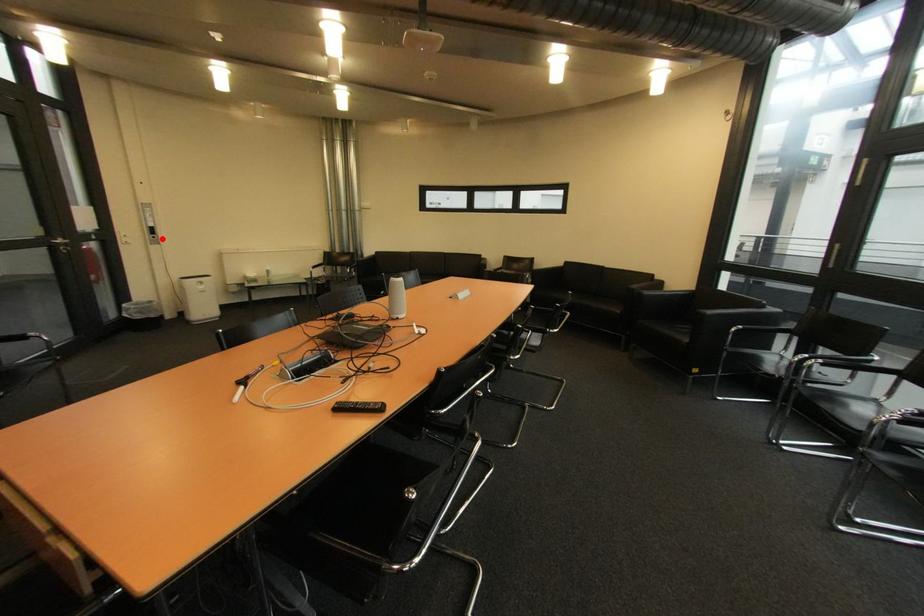
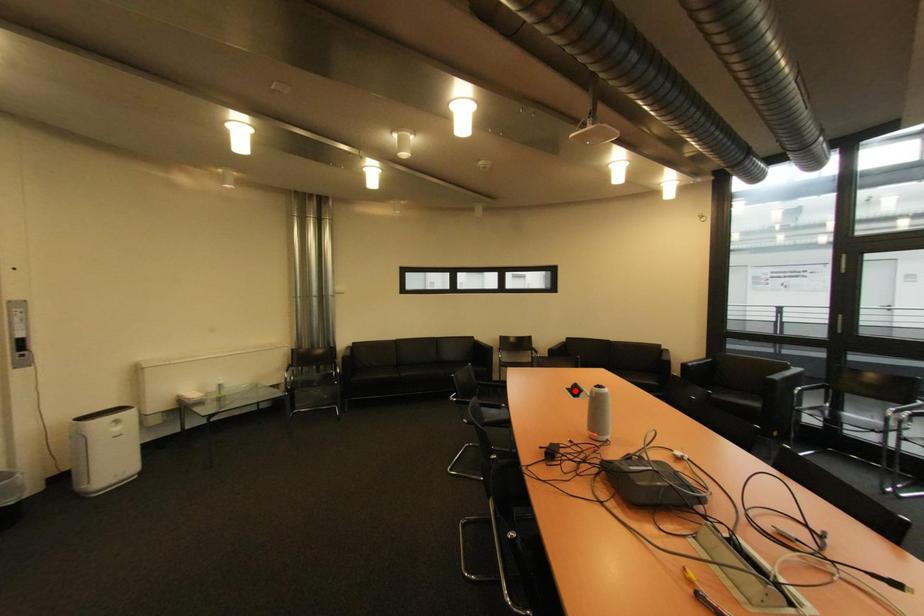
I am providing you with two images of the same scene from different viewpoints. A red point is marked on the first image and another point is marked on the second image. Is the marked point in image1 the same physical position as the marked point in image2?

No